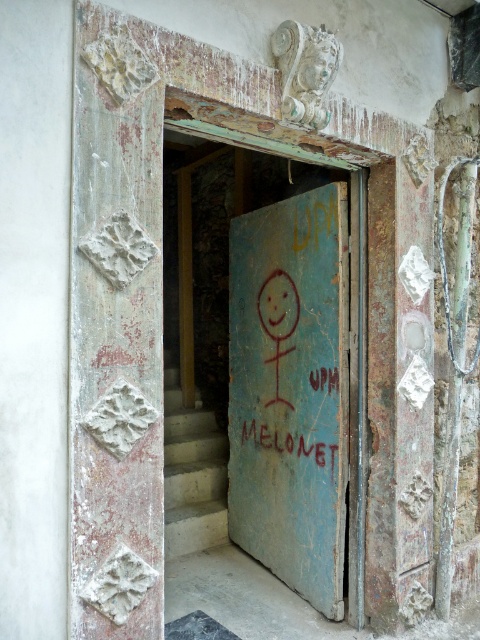
Question: Which of the following is the closest to the observer?

Choices:
 (A) (239, 444)
 (B) (297, 449)
 (C) (193, 532)

Answer: (B)

Question: Which object is closer to the camera taking this photo?

Choices:
 (A) concrete stairs at center
 (B) blue painted wood door at center

Answer: (B)

Question: Can you confirm if concrete stairs at center is positioned below red painted text at center?

Choices:
 (A) yes
 (B) no

Answer: (A)

Question: Does blue painted wood door at center have a smaller size compared to red painted text at center?

Choices:
 (A) no
 (B) yes

Answer: (A)

Question: Which of these objects is positioned closest to the red painted text at center?

Choices:
 (A) blue painted wood door at center
 (B) concrete stairs at center

Answer: (A)

Question: Considering the relative positions of blue painted wood door at center and red painted text at center in the image provided, where is blue painted wood door at center located with respect to red painted text at center?

Choices:
 (A) below
 (B) above

Answer: (B)